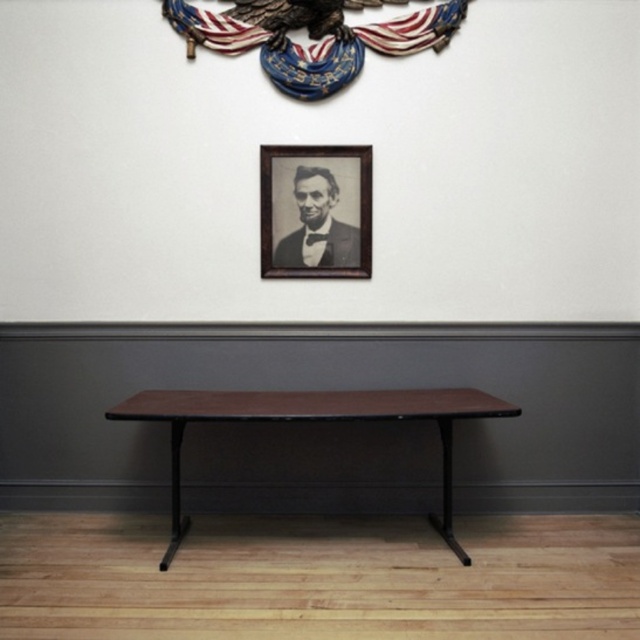
Can you confirm if brown laminate table at center is thinner than black wood picture frame at upper center?

No, brown laminate table at center is not thinner than black wood picture frame at upper center.

From the picture: Can you confirm if brown laminate table at center is taller than black wood picture frame at upper center?

Yes.

Between point (332, 396) and point (314, 228), which one is positioned behind?

Point (314, 228)

I want to click on brown laminate table at center, so click(310, 420).